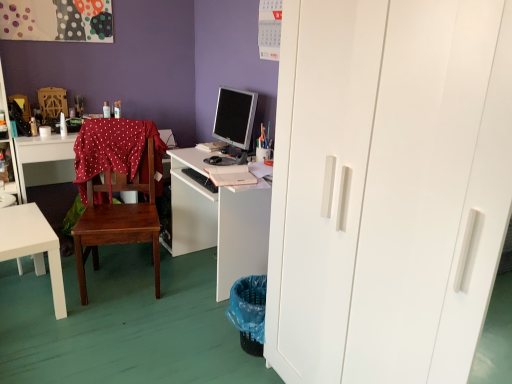
Question: From a real-world perspective, does white matte desk at center, positioned as the 3th desk in left-to-right order, sit lower than silver metallic monitor at center?

Choices:
 (A) yes
 (B) no

Answer: (A)

Question: Considering the relative positions of white matte desk at center, the first desk when ordered from right to left, and silver metallic monitor at center in the image provided, is white matte desk at center, the first desk when ordered from right to left, to the left of silver metallic monitor at center from the viewer's perspective?

Choices:
 (A) yes
 (B) no

Answer: (A)

Question: Is white matte desk at center, positioned as the 3th desk in left-to-right order, oriented away from silver metallic monitor at center?

Choices:
 (A) yes
 (B) no

Answer: (B)

Question: Can you confirm if white matte desk at center, positioned as the 3th desk in left-to-right order, is shorter than silver metallic monitor at center?

Choices:
 (A) yes
 (B) no

Answer: (B)

Question: Does white matte desk at center, positioned as the 3th desk in left-to-right order, lie behind silver metallic monitor at center?

Choices:
 (A) yes
 (B) no

Answer: (B)

Question: Is white glossy coffee cup at upper left inside or outside of red polka dot fabric at center?

Choices:
 (A) inside
 (B) outside

Answer: (B)

Question: Looking at their shapes, would you say white glossy coffee cup at upper left is wider or thinner than red polka dot fabric at center?

Choices:
 (A) wide
 (B) thin

Answer: (B)

Question: From a real-world perspective, is white glossy coffee cup at upper left above or below red polka dot fabric at center?

Choices:
 (A) below
 (B) above

Answer: (B)

Question: In terms of height, does white glossy coffee cup at upper left look taller or shorter compared to red polka dot fabric at center?

Choices:
 (A) tall
 (B) short

Answer: (B)

Question: Is wooden chair at center wider or thinner than black matte keyboard at center?

Choices:
 (A) wide
 (B) thin

Answer: (A)

Question: Considering their positions, is wooden chair at center located in front of or behind black matte keyboard at center?

Choices:
 (A) front
 (B) behind

Answer: (A)

Question: Considering the positions of wooden chair at center and black matte keyboard at center in the image, is wooden chair at center taller or shorter than black matte keyboard at center?

Choices:
 (A) short
 (B) tall

Answer: (B)

Question: Visually, is wooden chair at center positioned to the left or to the right of black matte keyboard at center?

Choices:
 (A) left
 (B) right

Answer: (A)

Question: In terms of height, does black matte keyboard at center look taller or shorter compared to white glossy coffee cup at upper left?

Choices:
 (A) short
 (B) tall

Answer: (A)

Question: Based on their sizes in the image, would you say black matte keyboard at center is bigger or smaller than white glossy coffee cup at upper left?

Choices:
 (A) small
 (B) big

Answer: (B)